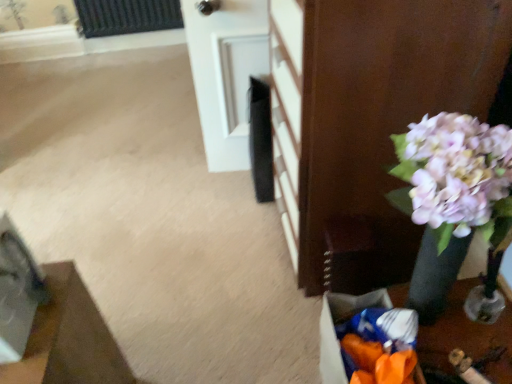
What do you see at coordinates (466, 337) in the screenshot?
I see `orange plastic bag at lower right` at bounding box center [466, 337].

This screenshot has width=512, height=384. Describe the element at coordinates (226, 74) in the screenshot. I see `white glossy door at upper center` at that location.

Image resolution: width=512 pixels, height=384 pixels. What are the coordinates of `white glossy door at upper center` in the screenshot? It's located at (226, 74).

The height and width of the screenshot is (384, 512). In order to click on orange plastic bag at lower right in this screenshot , I will do `click(466, 337)`.

Between wooden floor mat at lower left, which is counted as the second furniture, starting from the top, and white glossy door at upper center, which one has larger width?

With larger width is wooden floor mat at lower left, which is counted as the second furniture, starting from the top.

Is wooden floor mat at lower left, arranged as the 1th furniture when viewed from the left, oriented towards white glossy door at upper center?

No.

Which is correct: wooden floor mat at lower left, the second furniture in the right-to-left sequence, is inside white glossy door at upper center, or outside of it?

wooden floor mat at lower left, the second furniture in the right-to-left sequence, exists outside the volume of white glossy door at upper center.

Does point (54, 356) come behind point (264, 38)?

That is False.

Which is closer, (431,6) or (114,368)?

The point (431,6) is closer to the camera.

The width and height of the screenshot is (512, 384). I want to click on furniture above the wooden floor mat at lower left, which is counted as the second furniture, starting from the top (from the image's perspective), so [x=368, y=116].

Does matte black vase at right, which appears as the first furniture when viewed from the right, come behind wooden floor mat at lower left, which is counted as the second furniture, starting from the top?

Yes, matte black vase at right, which appears as the first furniture when viewed from the right, is further from the camera.

From a real-world perspective, between orange plastic bag at lower right and wooden floor mat at lower left, which is counted as the second furniture, starting from the top, who is vertically higher?

From a 3D spatial view, orange plastic bag at lower right is above.

From the image's perspective, is orange plastic bag at lower right located beneath wooden floor mat at lower left, the second furniture in the right-to-left sequence?

No, from the image's perspective, orange plastic bag at lower right is not beneath wooden floor mat at lower left, the second furniture in the right-to-left sequence.

Which is in front, point (332, 315) or point (31, 363)?

The point (31, 363) is in front.

How many degrees apart are the facing directions of matte black vase at right, which appears as the second furniture when ordered from the bottom, and orange plastic bag at lower right?

matte black vase at right, which appears as the second furniture when ordered from the bottom, and orange plastic bag at lower right are facing 0.399 degrees away from each other.

Considering their positions, is matte black vase at right, which appears as the first furniture when viewed from the right, located in front of or behind orange plastic bag at lower right?

Clearly, matte black vase at right, which appears as the first furniture when viewed from the right, is in front of orange plastic bag at lower right.

From a real-world perspective, is matte black vase at right, which appears as the second furniture when ordered from the bottom, physically below orange plastic bag at lower right?

No, from a real-world perspective, matte black vase at right, which appears as the second furniture when ordered from the bottom, is not under orange plastic bag at lower right.

From the image's perspective, is matte black vase at right, which appears as the second furniture when ordered from the bottom, on orange plastic bag at lower right?

Yes.

I want to click on door above the matte black vase at right, which appears as the second furniture when ordered from the bottom (from the image's perspective), so click(x=226, y=74).

Is white glossy door at upper center far away from matte black vase at right, which appears as the first furniture when viewed from the right?

No, there isn't a large distance between white glossy door at upper center and matte black vase at right, which appears as the first furniture when viewed from the right.

Between white glossy door at upper center and matte black vase at right, marked as the 2th furniture in a left-to-right arrangement, which one has smaller width?

white glossy door at upper center.

Considering the sizes of wooden floor mat at lower left, which is counted as the second furniture, starting from the top, and orange plastic bag at lower right in the image, is wooden floor mat at lower left, which is counted as the second furniture, starting from the top, taller or shorter than orange plastic bag at lower right?

Clearly, wooden floor mat at lower left, which is counted as the second furniture, starting from the top, is taller compared to orange plastic bag at lower right.

In the image, is wooden floor mat at lower left, arranged as the 1th furniture when viewed from the left, positioned in front of or behind orange plastic bag at lower right?

wooden floor mat at lower left, arranged as the 1th furniture when viewed from the left, is positioned closer to the viewer than orange plastic bag at lower right.

The height and width of the screenshot is (384, 512). Find the location of `table that is above the wooden floor mat at lower left, which is the first furniture in bottom-to-top order (from a real-world perspective)`. table that is above the wooden floor mat at lower left, which is the first furniture in bottom-to-top order (from a real-world perspective) is located at coordinates click(x=466, y=337).

Considering the sizes of objects white glossy door at upper center and wooden floor mat at lower left, the second furniture in the right-to-left sequence, in the image provided, who is thinner, white glossy door at upper center or wooden floor mat at lower left, the second furniture in the right-to-left sequence,?

white glossy door at upper center.

From a real-world perspective, is white glossy door at upper center below wooden floor mat at lower left, which is the first furniture in bottom-to-top order?

No, from a real-world perspective, white glossy door at upper center is not under wooden floor mat at lower left, which is the first furniture in bottom-to-top order.

How many degrees apart are the facing directions of white glossy door at upper center and wooden floor mat at lower left, arranged as the 1th furniture when viewed from the left?

The angular difference between white glossy door at upper center and wooden floor mat at lower left, arranged as the 1th furniture when viewed from the left, is 175 degrees.

Is white glossy door at upper center smaller than wooden floor mat at lower left, the second furniture in the right-to-left sequence?

No.

Starting from the white glossy door at upper center, which furniture is the 2nd one in front? Please provide its 2D coordinates.

[(68, 339)]

You are a GUI agent. You are given a task and a screenshot of the screen. Output one action in this format:
    pyautogui.click(x=<x>, y=<y>)
    Task: Click on the furniture above the wooden floor mat at lower left, the second furniture in the right-to-left sequence (from the image's perspective)
    The image size is (512, 384).
    Given the screenshot: What is the action you would take?
    pyautogui.click(x=368, y=116)

From the image, which object appears to be farther from white glossy door at upper center, matte black vase at right, which appears as the second furniture when ordered from the bottom, or wooden floor mat at lower left, arranged as the 1th furniture when viewed from the left?

wooden floor mat at lower left, arranged as the 1th furniture when viewed from the left, is positioned further to the anchor white glossy door at upper center.

Based on their spatial positions, is orange plastic bag at lower right or wooden floor mat at lower left, which is counted as the second furniture, starting from the top, further from white glossy door at upper center?

The object further to white glossy door at upper center is wooden floor mat at lower left, which is counted as the second furniture, starting from the top.

In the scene shown: Looking at the image, which one is located further to orange plastic bag at lower right, white glossy door at upper center or wooden floor mat at lower left, the second furniture in the right-to-left sequence?

white glossy door at upper center is positioned further to the anchor orange plastic bag at lower right.

When comparing their distances from wooden floor mat at lower left, which is the first furniture in bottom-to-top order, does white glossy door at upper center or orange plastic bag at lower right seem further?

white glossy door at upper center is positioned further to the anchor wooden floor mat at lower left, which is the first furniture in bottom-to-top order.

Looking at the image, which one is located closer to matte black vase at right, marked as the 2th furniture in a left-to-right arrangement, white glossy door at upper center or wooden floor mat at lower left, which is the first furniture in bottom-to-top order?

white glossy door at upper center.

Which object lies nearer to the anchor point matte black vase at right, positioned as the 1th furniture in top-to-bottom order, wooden floor mat at lower left, arranged as the 1th furniture when viewed from the left, or orange plastic bag at lower right?

orange plastic bag at lower right lies closer to matte black vase at right, positioned as the 1th furniture in top-to-bottom order, than the other object.

Looking at the image, which one is located further to matte black vase at right, which appears as the second furniture when ordered from the bottom, white glossy door at upper center or orange plastic bag at lower right?

Among the two, white glossy door at upper center is located further to matte black vase at right, which appears as the second furniture when ordered from the bottom.

Which object lies nearer to the anchor point white glossy door at upper center, wooden floor mat at lower left, which is counted as the second furniture, starting from the top, or matte black vase at right, which appears as the first furniture when viewed from the right?

Among the two, matte black vase at right, which appears as the first furniture when viewed from the right, is located nearer to white glossy door at upper center.

The height and width of the screenshot is (384, 512). Find the location of `furniture between white glossy door at upper center and wooden floor mat at lower left, the second furniture in the right-to-left sequence, in the vertical direction`. furniture between white glossy door at upper center and wooden floor mat at lower left, the second furniture in the right-to-left sequence, in the vertical direction is located at coordinates (368, 116).

Locate an element on the screen. furniture between white glossy door at upper center and orange plastic bag at lower right in the up-down direction is located at coordinates (368, 116).

I want to click on table located between wooden floor mat at lower left, which is counted as the second furniture, starting from the top, and matte black vase at right, positioned as the 1th furniture in top-to-bottom order, in the left-right direction, so click(466, 337).

Identify the location of table between white glossy door at upper center and wooden floor mat at lower left, which is counted as the second furniture, starting from the top, in the vertical direction. (466, 337).